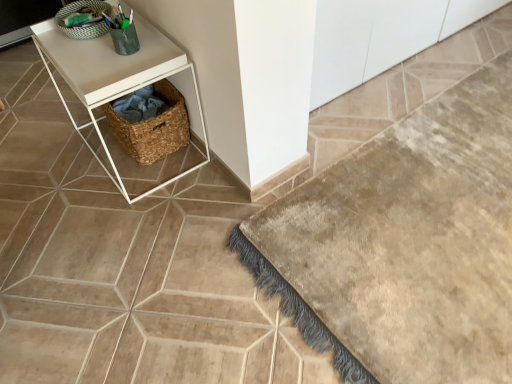
This screenshot has width=512, height=384. In order to click on free space above green woven basket at upper left, positioned as the 1th basket in top-to-bottom order (from a real-world perspective) in this screenshot , I will do `click(86, 9)`.